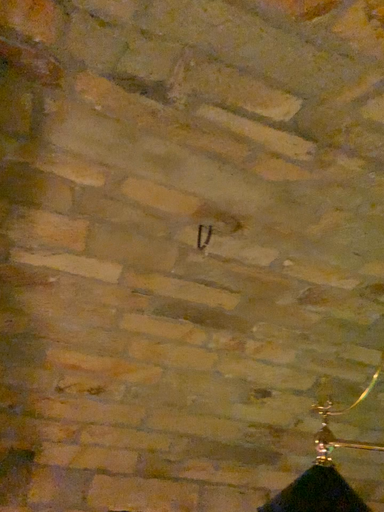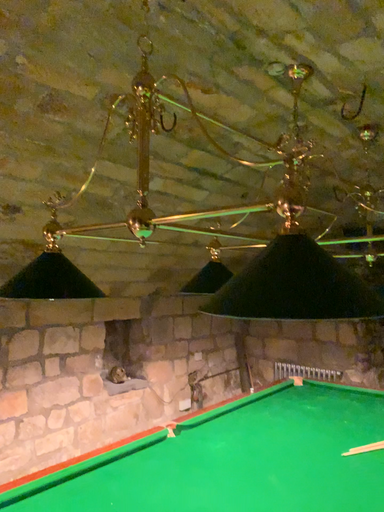
Question: How did the camera likely rotate when shooting the video?

Choices:
 (A) rotated left
 (B) rotated right

Answer: (B)